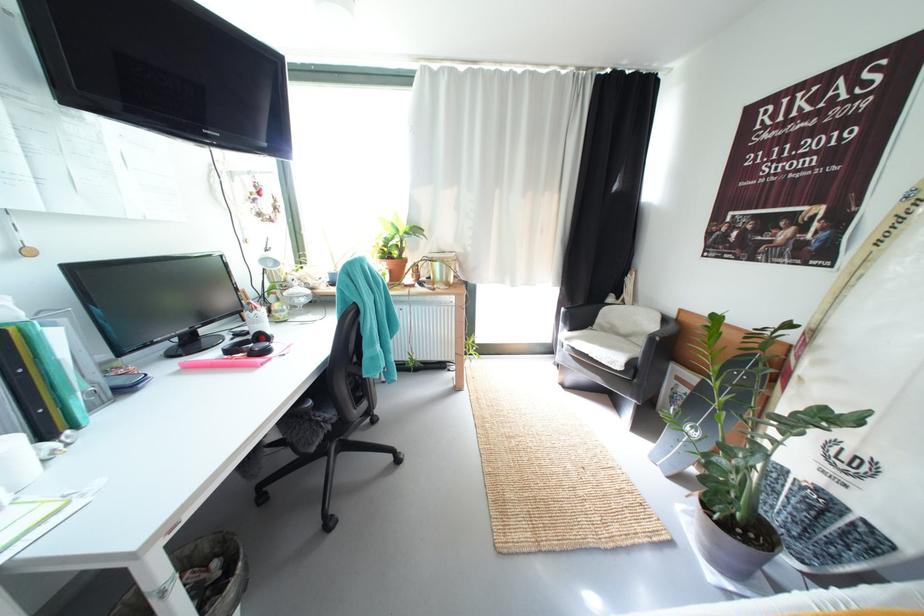
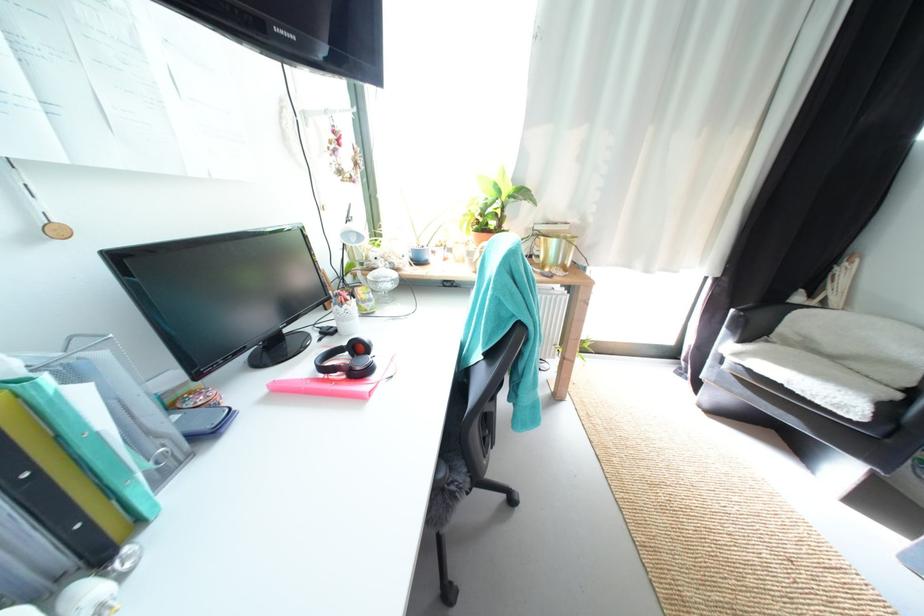
Question: I am providing you with two images of the same scene from different viewpoints. Which of the following objects are not visible in image2?

Choices:
 (A) terracotta potted plant
 (B) yellow binder hole
 (C) glass lidded dish
 (D) none of these

Answer: (D)